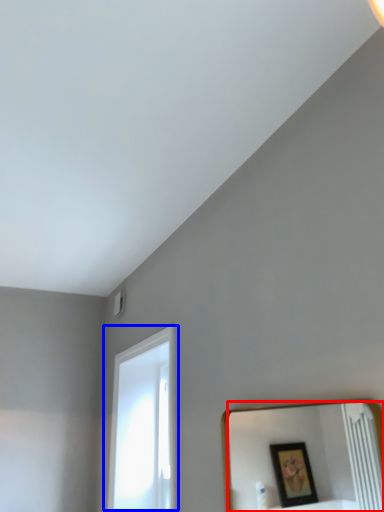
Question: Which object appears closest to the camera in this image, mirror (highlighted by a red box) or window (highlighted by a blue box)?

Choices:
 (A) mirror
 (B) window

Answer: (A)